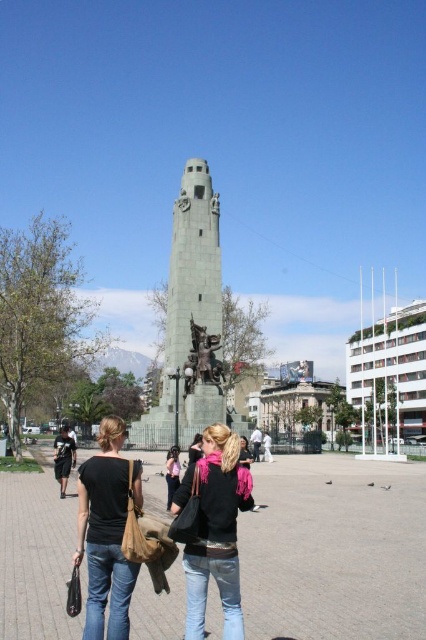
You are a photographer standing in the public square and want to capture both the black leather jacket at center and the matte black hair at center in your photo. Which object should you focus on first to ensure both are in frame?

The black leather jacket at center is taller than the matte black hair at center, so you should focus on the black leather jacket at center first to ensure both are in frame.

You are standing in the public square and want to take a photo of the monument. The camera you are using has a focal length of 50mm and a sensor size of 24mm x 36mm. The point at coordinates point (109, 483) is where you want to focus. What is the minimum distance you need to be from the monument to ensure the entire monument fits in the frame?

The distance of point (109, 483) from the camera is 30.64 meters. To ensure the entire monument fits in the frame, you need to be at least 30.64 meters away from the monument.